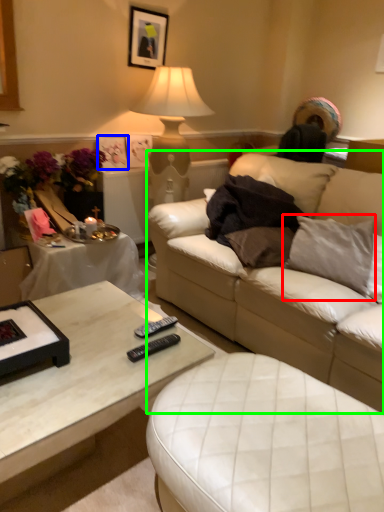
Question: Based on their relative distances, which object is farther from pillow (highlighted by a red box)? Choose from picture frame (highlighted by a blue box) and studio couch (highlighted by a green box).

Choices:
 (A) picture frame
 (B) studio couch

Answer: (A)